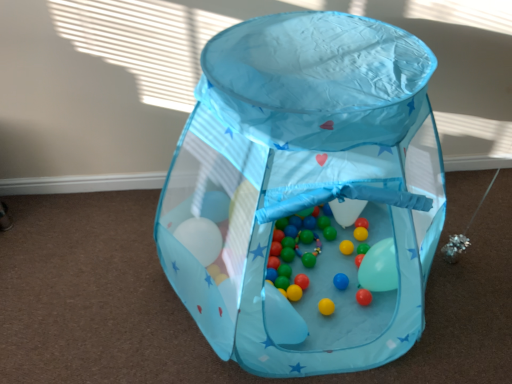
Describe the element at coordinates (306, 189) in the screenshot. This screenshot has height=384, width=512. I see `transparent fabric playpen at center` at that location.

Identify the location of transparent fabric playpen at center. (306, 189).

This screenshot has width=512, height=384. Identify the location of matte plastic balls at center. (296, 245).

Describe the element at coordinates (296, 245) in the screenshot. The height and width of the screenshot is (384, 512). I see `matte plastic balls at center` at that location.

I want to click on transparent fabric playpen at center, so click(x=306, y=189).

Can you confirm if matte plastic balls at center is positioned to the right of transparent fabric playpen at center?

Yes.

Which object is closer to the camera, matte plastic balls at center or transparent fabric playpen at center?

transparent fabric playpen at center.

Which is less distant, [298,282] or [188,227]?

Point [298,282] is farther from the camera than point [188,227].

From the image's perspective, which one is positioned higher, matte plastic balls at center or transparent fabric playpen at center?

From the image's view, transparent fabric playpen at center is above.

From a real-world perspective, is matte plastic balls at center positioned above or below transparent fabric playpen at center?

matte plastic balls at center is situated lower than transparent fabric playpen at center in the real world.

In terms of width, does matte plastic balls at center look wider or thinner when compared to transparent fabric playpen at center?

Considering their sizes, matte plastic balls at center looks slimmer than transparent fabric playpen at center.

Considering the relative sizes of matte plastic balls at center and transparent fabric playpen at center in the image provided, is matte plastic balls at center shorter than transparent fabric playpen at center?

Yes.

Which of these two, matte plastic balls at center or transparent fabric playpen at center, is smaller?

matte plastic balls at center.

Looking at this image, which is correct: matte plastic balls at center is inside transparent fabric playpen at center, or outside of it?

matte plastic balls at center can be found inside transparent fabric playpen at center.

Is matte plastic balls at center far away from transparent fabric playpen at center?

Actually, matte plastic balls at center and transparent fabric playpen at center are a little close together.

Is matte plastic balls at center looking in the opposite direction of transparent fabric playpen at center?

Yes.

What's the angular difference between matte plastic balls at center and transparent fabric playpen at center's facing directions?

The facing directions of matte plastic balls at center and transparent fabric playpen at center are 15.6 degrees apart.

Measure the distance from matte plastic balls at center to transparent fabric playpen at center.

A distance of 15.25 inches exists between matte plastic balls at center and transparent fabric playpen at center.

The width and height of the screenshot is (512, 384). Find the location of `toy below the transparent fabric playpen at center (from a real-world perspective)`. toy below the transparent fabric playpen at center (from a real-world perspective) is located at coordinates (296, 245).

Between transparent fabric playpen at center and matte plastic balls at center, which one appears on the right side from the viewer's perspective?

From the viewer's perspective, matte plastic balls at center appears more on the right side.

Which object is further away from the camera taking this photo, transparent fabric playpen at center or matte plastic balls at center?

matte plastic balls at center.

Between point (387, 189) and point (310, 257), which one is positioned behind?

The point (310, 257) is behind.

From the image's perspective, which is below, transparent fabric playpen at center or matte plastic balls at center?

matte plastic balls at center.

From a real-world perspective, which object rests below the other?

matte plastic balls at center, from a real-world perspective.

Between transparent fabric playpen at center and matte plastic balls at center, which one has larger width?

Wider between the two is transparent fabric playpen at center.

Considering the sizes of transparent fabric playpen at center and matte plastic balls at center in the image, is transparent fabric playpen at center taller or shorter than matte plastic balls at center?

In the image, transparent fabric playpen at center appears to be taller than matte plastic balls at center.

Considering the relative sizes of transparent fabric playpen at center and matte plastic balls at center in the image provided, is transparent fabric playpen at center smaller than matte plastic balls at center?

Incorrect, transparent fabric playpen at center is not smaller in size than matte plastic balls at center.

Is matte plastic balls at center surrounded by transparent fabric playpen at center?

Yes, transparent fabric playpen at center contains matte plastic balls at center.

Would you say transparent fabric playpen at center is a long distance from matte plastic balls at center?

transparent fabric playpen at center is actually quite close to matte plastic balls at center.

Is matte plastic balls at center at the back of transparent fabric playpen at center?

That's not correct — transparent fabric playpen at center is not looking away from matte plastic balls at center.

How many degrees apart are the facing directions of transparent fabric playpen at center and matte plastic balls at center?

15.6 degrees.

Locate an element on the screen. toy that is behind the transparent fabric playpen at center is located at coordinates (296, 245).

Image resolution: width=512 pixels, height=384 pixels. What are the coordinates of `toy below the transparent fabric playpen at center (from a real-world perspective)` in the screenshot? It's located at (296, 245).

You are a GUI agent. You are given a task and a screenshot of the screen. Output one action in this format:
    pyautogui.click(x=<x>, y=<y>)
    Task: Click on the toy behind the transparent fabric playpen at center
    This screenshot has width=512, height=384.
    Given the screenshot: What is the action you would take?
    pyautogui.click(x=296, y=245)